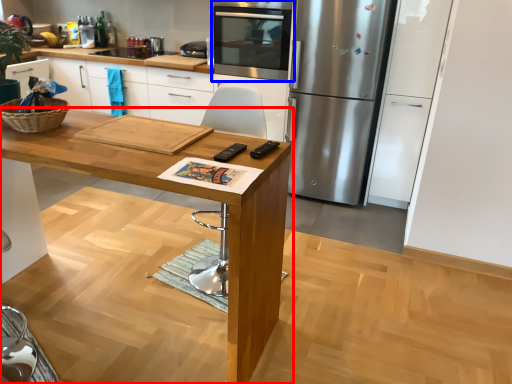
Question: Which of the following is the closest to the observer, table (highlighted by a red box) or home appliance (highlighted by a blue box)?

Choices:
 (A) table
 (B) home appliance

Answer: (A)